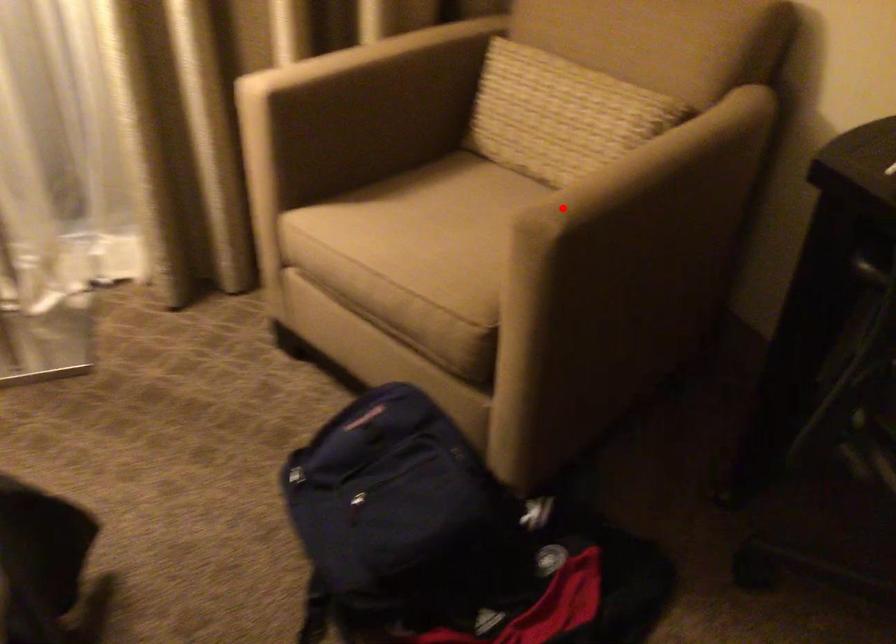
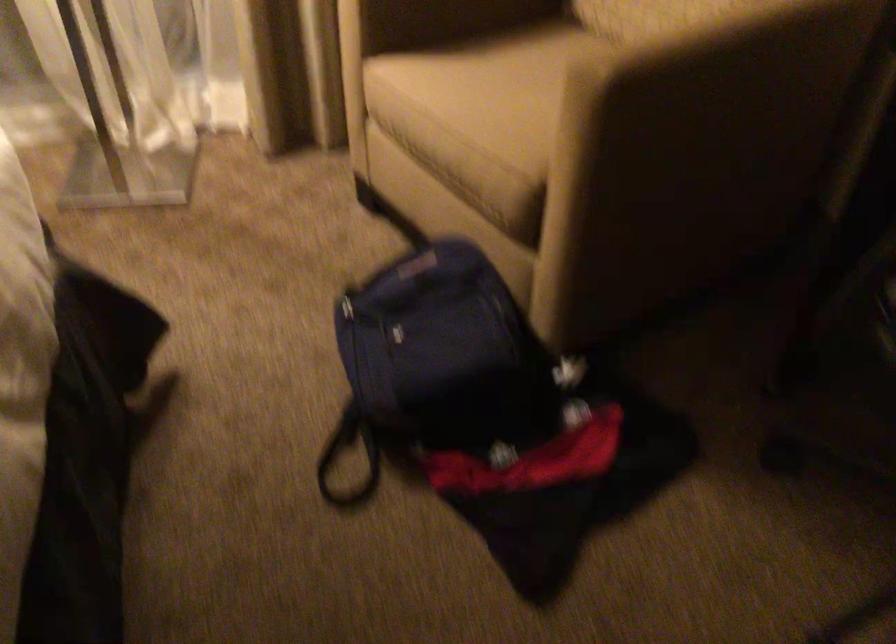
Question: I am providing you with two images of the same scene from different viewpoints. A red point is marked on the first image. Can you still see the location of the red point in image 2?

Choices:
 (A) Yes
 (B) No

Answer: (A)